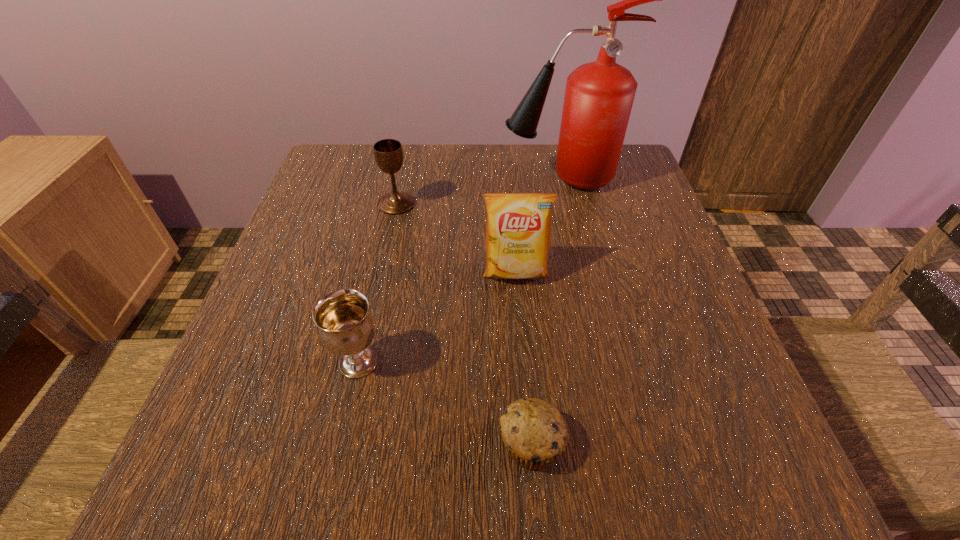
Where is `free location located 0.090m on the back of the farther chalice`? This screenshot has width=960, height=540. free location located 0.090m on the back of the farther chalice is located at coordinates (404, 172).

Where is `free space located on the left of the nearer chalice`? free space located on the left of the nearer chalice is located at coordinates (284, 362).

I want to click on vacant region located on the left of the shortest object, so click(x=406, y=443).

What are the coordinates of `fire extinguisher located at the far edge` in the screenshot? It's located at (599, 95).

The width and height of the screenshot is (960, 540). What are the coordinates of `chalice positioned at the far edge` in the screenshot? It's located at (388, 153).

At what (x,y) coordinates should I click in order to perform the action: click on object at the near edge. Please return your answer as a coordinate pair (x, y). Looking at the image, I should click on (534, 432).

Where is `object that is at the right edge`? The image size is (960, 540). object that is at the right edge is located at coordinates (599, 95).

Locate an element on the screen. This screenshot has height=540, width=960. object that is at the far right corner is located at coordinates (599, 95).

In the image, there is a desktop. Where is `free space at the far edge`? free space at the far edge is located at coordinates (415, 176).

Where is `vacant space at the near edge`? Image resolution: width=960 pixels, height=540 pixels. vacant space at the near edge is located at coordinates (540, 478).